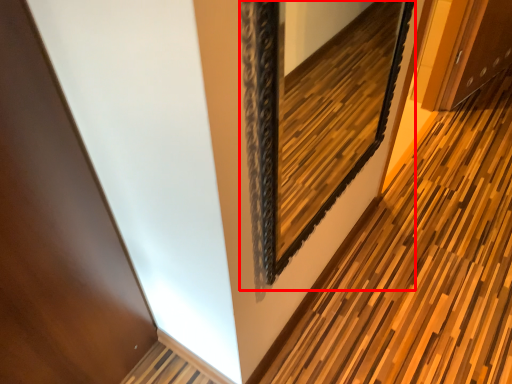
Question: From the image's perspective, what is the correct spatial positioning of picture frame (annotated by the red box) in reference to path?

Choices:
 (A) above
 (B) below

Answer: (A)